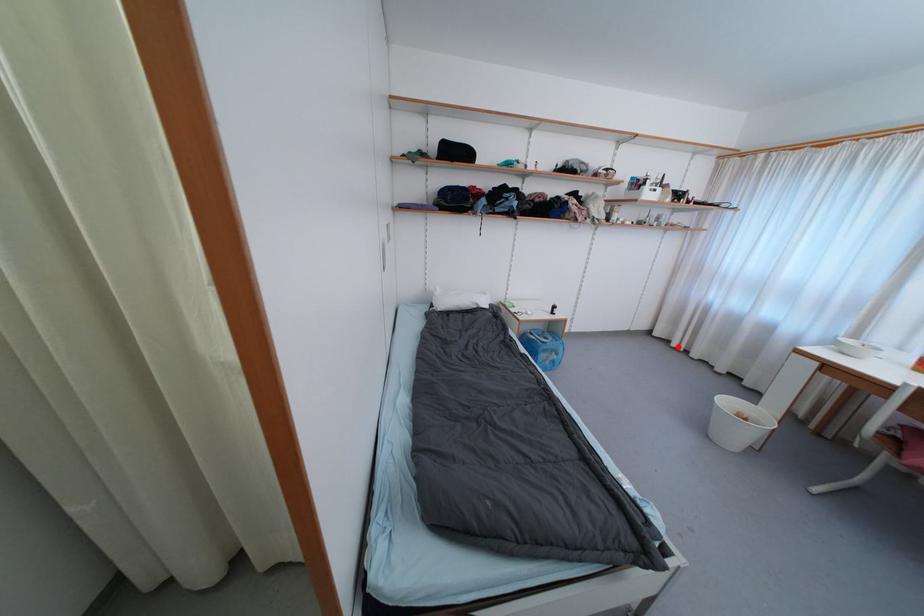
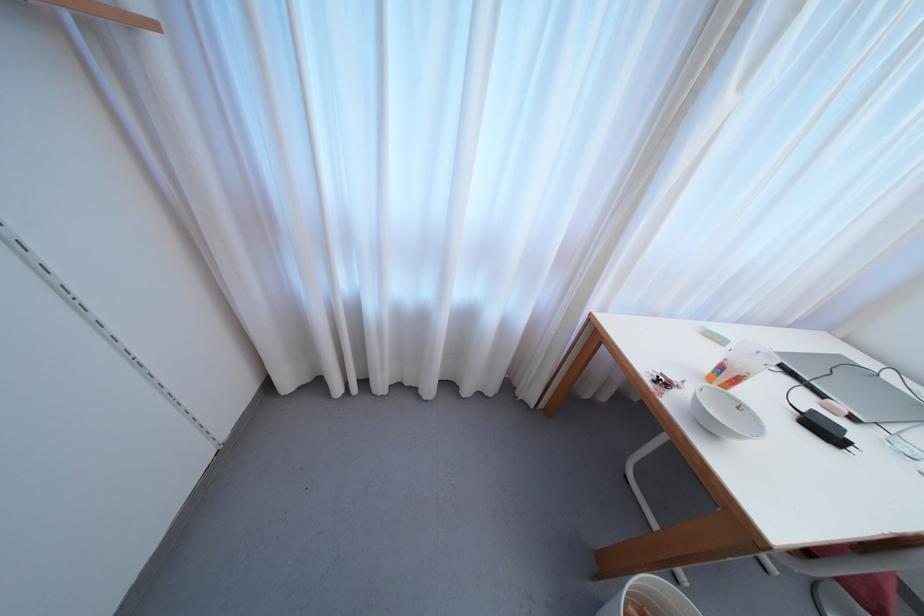
Question: I am providing you with two images of the same scene from different viewpoints. A red point is shown in image1. For the corresponding object point in image2, is it positioned nearer or farther from the camera?

Choices:
 (A) Nearer
 (B) Farther

Answer: (B)